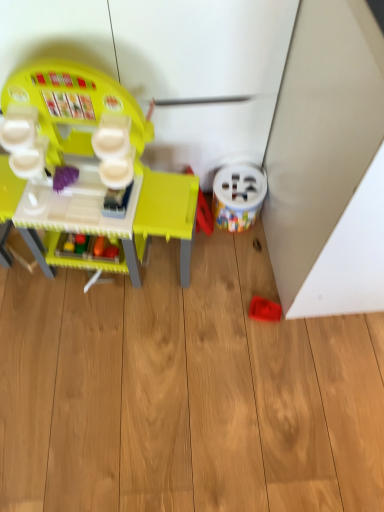
Question: From a real-world perspective, is rubberized red toy at lower right, the 3th toy from the left, positioned under white plastic bucket at lower right, the second toy viewed from the right, based on gravity?

Choices:
 (A) yes
 (B) no

Answer: (A)

Question: Can you confirm if rubberized red toy at lower right, which appears as the 1th toy when viewed from the right, is smaller than white plastic bucket at lower right, the second toy viewed from the right?

Choices:
 (A) no
 (B) yes

Answer: (B)

Question: Can you confirm if rubberized red toy at lower right, which appears as the 1th toy when viewed from the right, is taller than white plastic bucket at lower right, the 2th toy when ordered from left to right?

Choices:
 (A) no
 (B) yes

Answer: (A)

Question: From a real-world perspective, is rubberized red toy at lower right, the 3th toy from the left, on white plastic bucket at lower right, the 2th toy when ordered from left to right?

Choices:
 (A) yes
 (B) no

Answer: (B)

Question: From the image's perspective, is rubberized red toy at lower right, the 3th toy from the left, on white plastic bucket at lower right, the 2th toy when ordered from left to right?

Choices:
 (A) no
 (B) yes

Answer: (A)

Question: Is rubberized red toy at lower right, the 3th toy from the left, outside of white plastic bucket at lower right, the 2th toy when ordered from left to right?

Choices:
 (A) no
 (B) yes

Answer: (B)

Question: Is rubberized red toy at lower right, which appears as the 1th toy when viewed from the right, at the back of white plastic bucket at lower right, the second toy viewed from the right?

Choices:
 (A) no
 (B) yes

Answer: (A)

Question: Does white plastic bucket at lower right, the second toy viewed from the right, appear on the right side of rubberized red toy at lower right, which appears as the 1th toy when viewed from the right?

Choices:
 (A) no
 (B) yes

Answer: (A)

Question: Is white plastic bucket at lower right, the 2th toy when ordered from left to right, closer to the viewer compared to rubberized red toy at lower right, the 3th toy from the left?

Choices:
 (A) no
 (B) yes

Answer: (B)

Question: Is white plastic bucket at lower right, the 2th toy when ordered from left to right, surrounding rubberized red toy at lower right, which appears as the 1th toy when viewed from the right?

Choices:
 (A) yes
 (B) no

Answer: (B)

Question: Does white plastic bucket at lower right, the second toy viewed from the right, turn towards rubberized red toy at lower right, the 3th toy from the left?

Choices:
 (A) yes
 (B) no

Answer: (A)

Question: Can you confirm if white plastic bucket at lower right, the second toy viewed from the right, is taller than rubberized red toy at lower right, which appears as the 1th toy when viewed from the right?

Choices:
 (A) yes
 (B) no

Answer: (A)

Question: Is white plastic bucket at lower right, the 2th toy when ordered from left to right, to the left of matte plastic play kitchen at left, placed as the first toy when sorted from left to right, from the viewer's perspective?

Choices:
 (A) yes
 (B) no

Answer: (B)